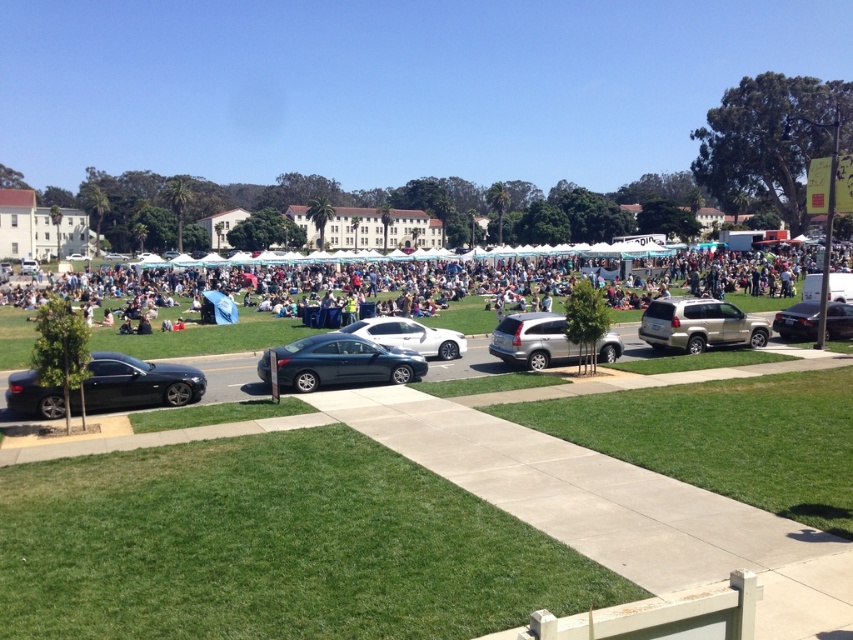
Who is higher up, satin silver sedan at center or satin black sedan at right?

Positioned higher is satin silver sedan at center.

Between point (434, 330) and point (808, 336), which one is positioned in front?

Positioned in front is point (434, 330).

Where is `satin silver sedan at center`? Image resolution: width=853 pixels, height=640 pixels. satin silver sedan at center is located at coordinates (410, 336).

The height and width of the screenshot is (640, 853). Identify the location of satin silver sedan at center. (410, 336).

Describe the element at coordinates (138, 381) in the screenshot. I see `shiny black car at lower left` at that location.

Who is taller, shiny black car at lower left or satin black sedan at right?

Standing taller between the two is shiny black car at lower left.

Is point (119, 390) farther from camera compared to point (793, 326)?

No, (119, 390) is closer to viewer.

Locate an element on the screen. The image size is (853, 640). shiny black car at lower left is located at coordinates (138, 381).

Is multicolored fabric tents at center below shiny black car at lower left?

No.

Image resolution: width=853 pixels, height=640 pixels. What are the coordinates of `multicolored fabric tents at center` in the screenshot? It's located at (508, 269).

Is point (431, 288) positioned behind point (38, 410)?

Yes, point (431, 288) is farther from viewer.

You are a GUI agent. You are given a task and a screenshot of the screen. Output one action in this format:
    pyautogui.click(x=<x>, y=<y>)
    Task: Click on the multicolored fabric tents at center
    This screenshot has width=853, height=640.
    Given the screenshot: What is the action you would take?
    [508, 269]